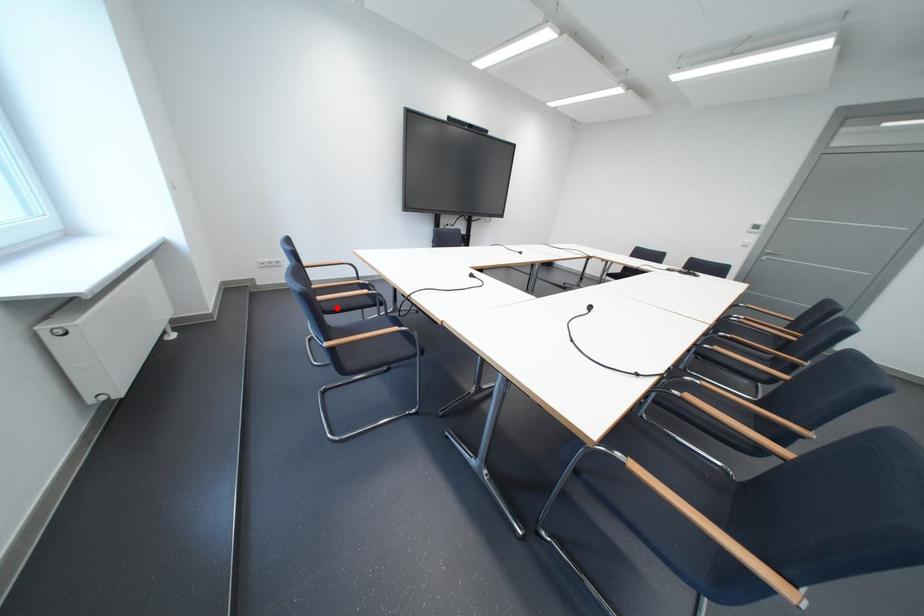
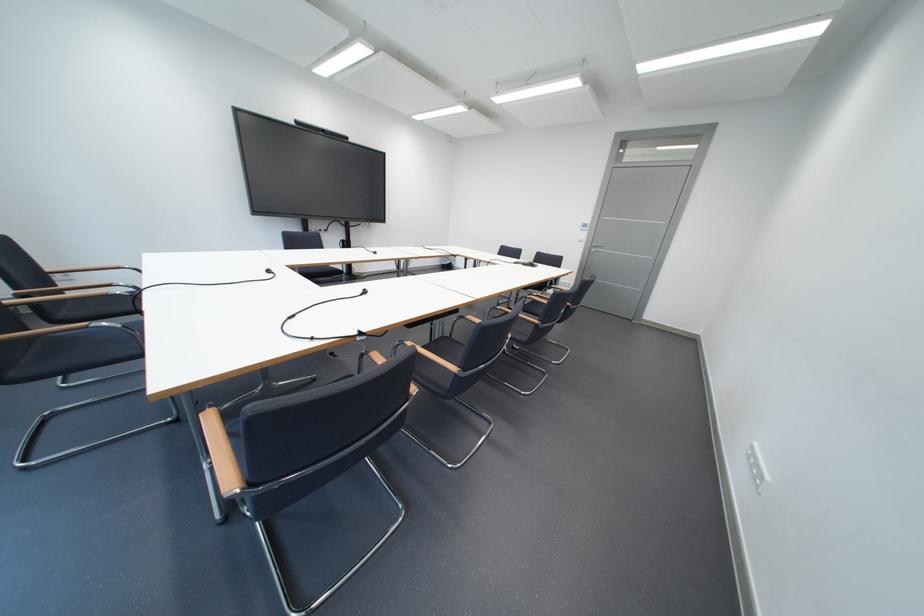
Question: I am providing you with two images of the same scene from different viewpoints. Given a red point in image1, look at the same physical point in image2. Is it:

Choices:
 (A) Closer to the viewpoint
 (B) Farther from the viewpoint

Answer: (B)